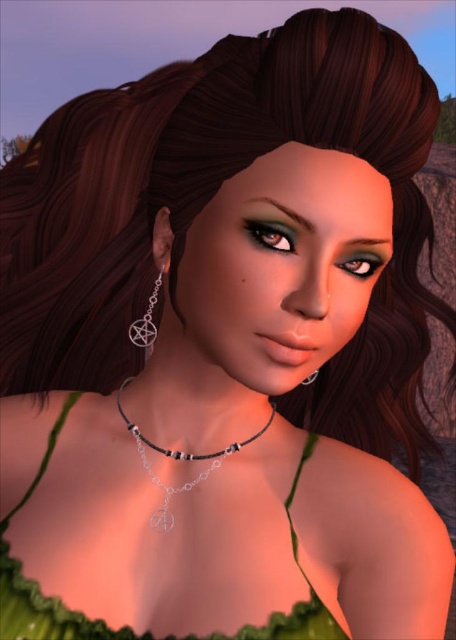
Question: Can you confirm if silver metallic pentagram at ear is bigger than silver metallic pentagram at center?

Choices:
 (A) no
 (B) yes

Answer: (B)

Question: Among these objects, which one is nearest to the camera?

Choices:
 (A) silver metallic pentagram at ear
 (B) silver metallic pentagram at center
 (C) silver metallic necklace at center
 (D) green fabric dress at center

Answer: (D)

Question: Which of these objects is positioned farthest from the silver metallic pentagram at center?

Choices:
 (A) silver metallic necklace at center
 (B) green fabric dress at center

Answer: (B)

Question: In this image, where is silver metallic necklace at center located relative to silver metallic pentagram at center?

Choices:
 (A) below
 (B) above

Answer: (A)

Question: Which of these objects is positioned closest to the silver metallic necklace at center?

Choices:
 (A) silver metallic pentagram at ear
 (B) silver metallic pentagram at center
 (C) green fabric dress at center

Answer: (C)

Question: Is green fabric dress at center thinner than silver metallic pentagram at center?

Choices:
 (A) yes
 (B) no

Answer: (B)